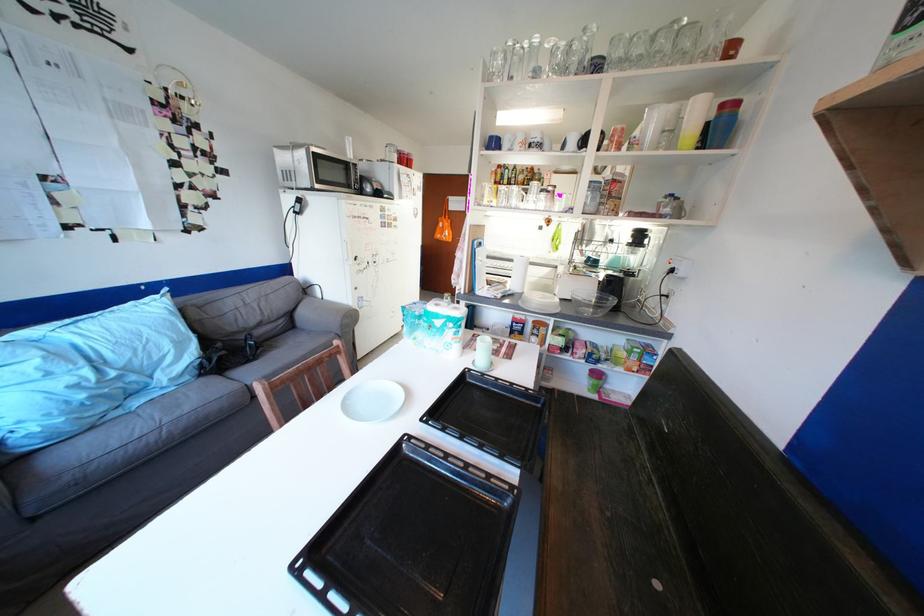
Where would you lift the blender pitcher? Please return your answer as a coordinate pair (x, y).

(647, 238)